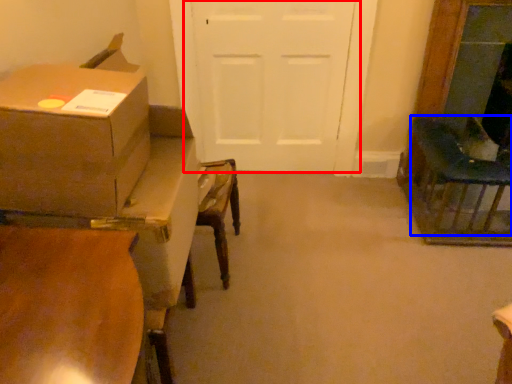
Question: Which object appears closest to the camera in this image, door (highlighted by a red box) or chair (highlighted by a blue box)?

Choices:
 (A) door
 (B) chair

Answer: (B)